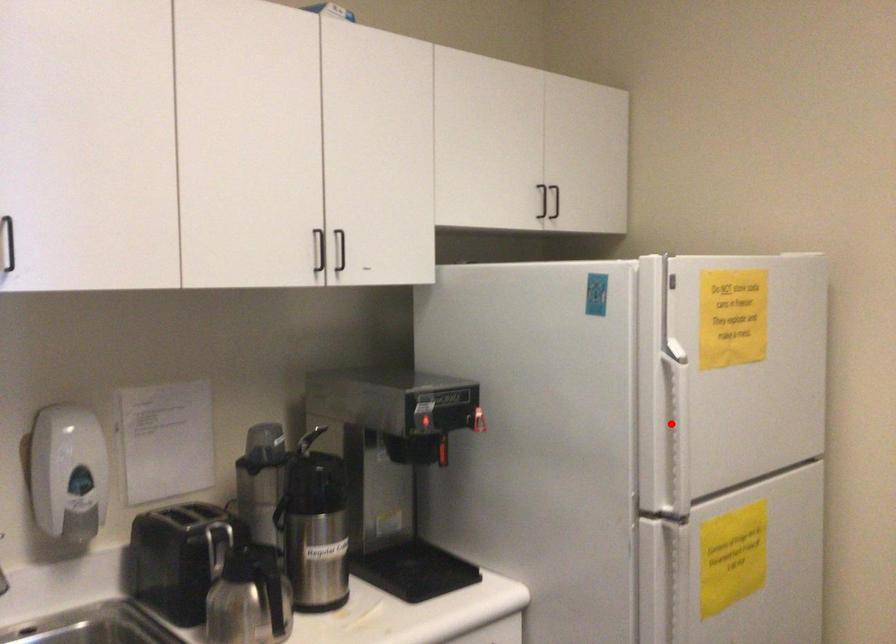
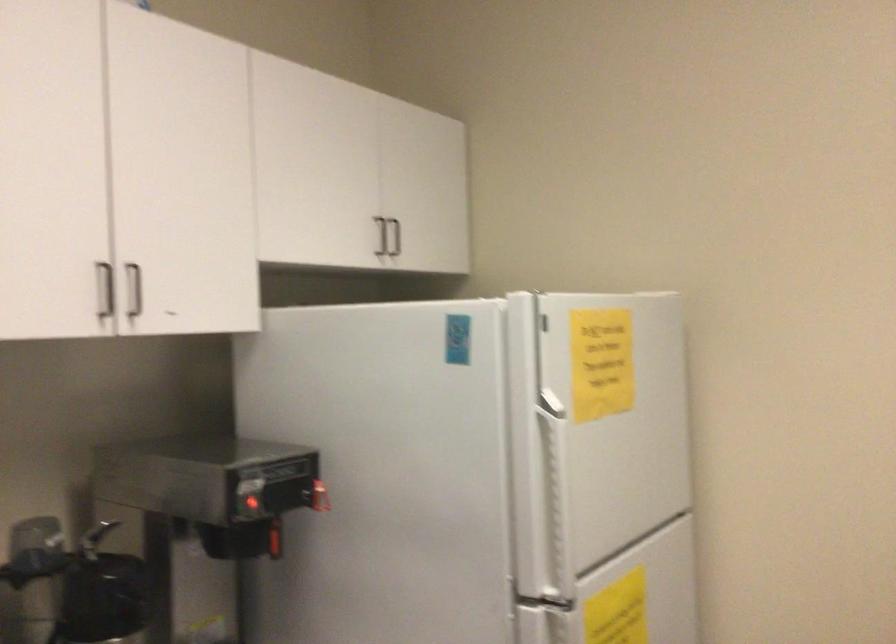
In the second image, find the point that corresponds to the highlighted location in the first image.

(554, 486)